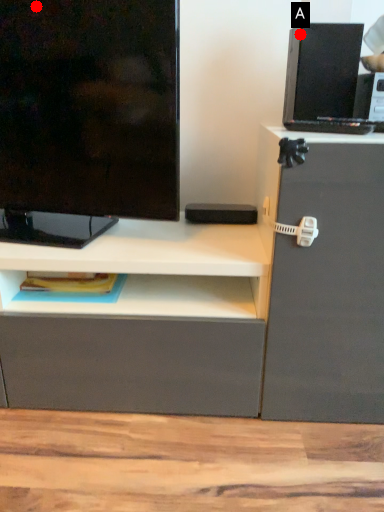
Question: Two points are circled on the image, labeled by A and B beside each circle. Among these points, which one is nearest to the camera?

Choices:
 (A) A is closer
 (B) B is closer

Answer: (B)